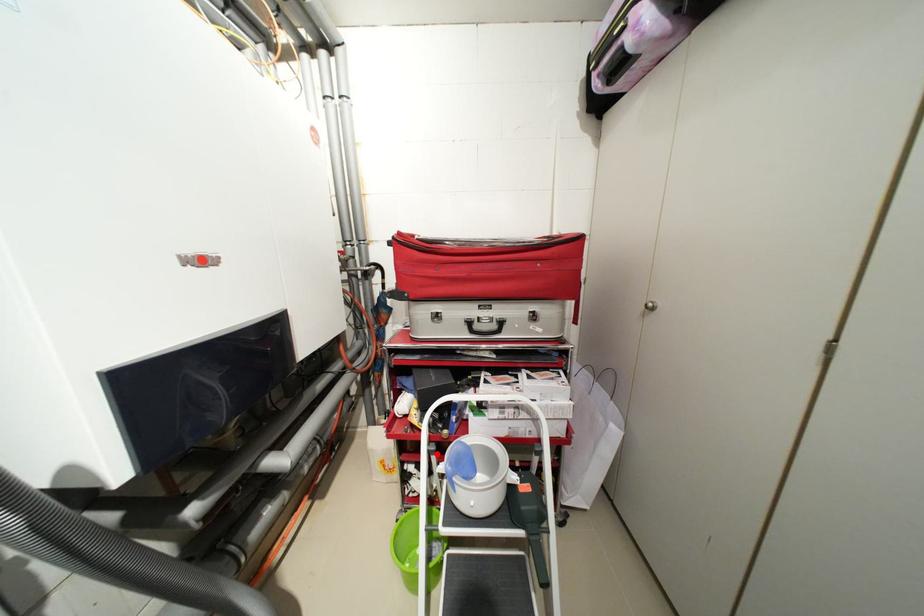
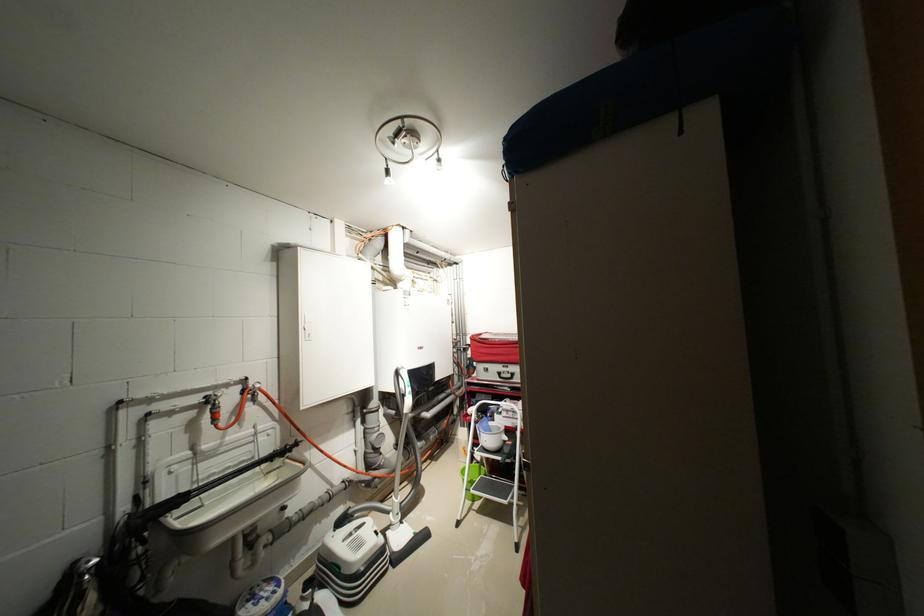
Question: I am providing you with two images of the same scene from different viewpoints. A red point is shown in image1. For the corresponding object point in image2, is it positioned nearer or farther from the camera?

Choices:
 (A) Nearer
 (B) Farther

Answer: (B)